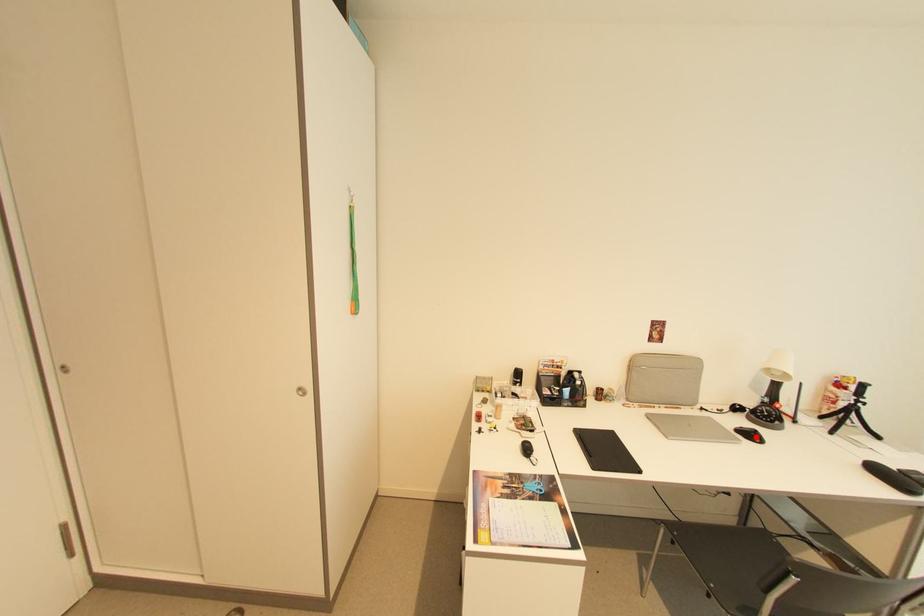
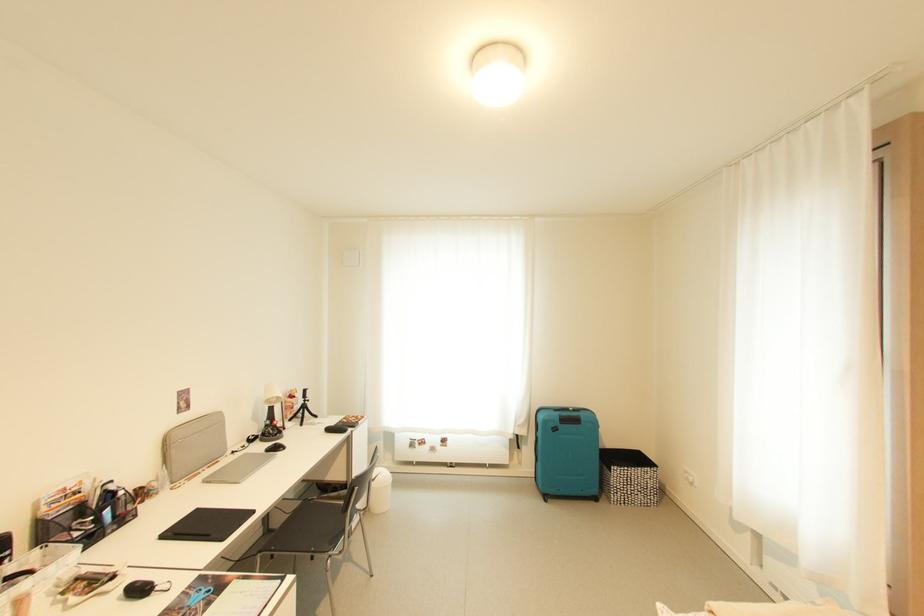
The point at the highlighted location is marked in the first image. Where is the corresponding point in the second image?

(282, 450)